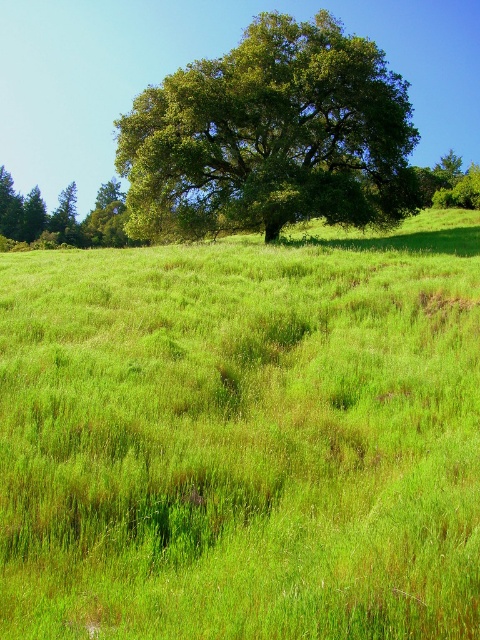
You are planning to plant a new tree in your garden. You have two options based on the image provided. The first option is the green leafy tree at center, and the second is the green leafy tree at upper left. If you want a tree that takes up less space horizontally, which one should you choose?

The green leafy tree at center has a smaller width compared to the green leafy tree at upper left, so you should choose the green leafy tree at center for a tree that takes up less horizontal space.

You are standing at the point labeled point (14, 218) and want to walk towards the tree in the midground. Is the point labeled point (205, 625) blocking your path?

Point (205, 625) is in front of point (14, 218), so yes, the point labeled point (205, 625) is blocking your path to the tree in the midground.